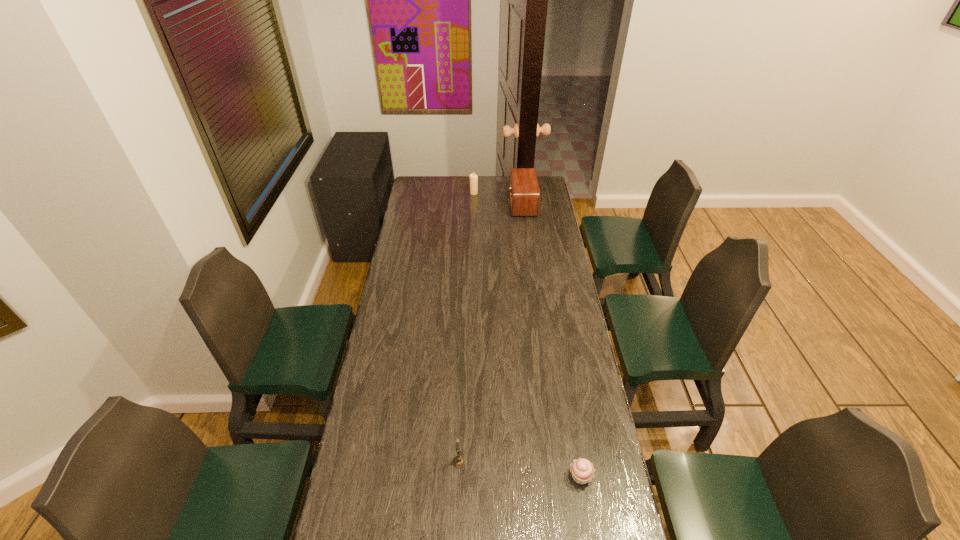
Where is `radio receiver located at the far edge`? radio receiver located at the far edge is located at coordinates (524, 193).

This screenshot has width=960, height=540. I want to click on candle that is positioned at the far edge, so click(x=473, y=177).

The height and width of the screenshot is (540, 960). Identify the location of radio receiver present at the right edge. (524, 193).

Identify the location of cupcake that is positioned at the right edge. (582, 470).

Where is `object at the far right corner`? This screenshot has height=540, width=960. object at the far right corner is located at coordinates (524, 193).

Where is `vacant space at the left edge`? vacant space at the left edge is located at coordinates [391, 299].

Locate an element on the screen. blank space at the right edge of the desktop is located at coordinates (552, 325).

Image resolution: width=960 pixels, height=540 pixels. In the image, there is a desktop. Identify the location of vacant space at the far right corner. (546, 178).

Find the location of `free area in between the nearer candle and the cupcake`. free area in between the nearer candle and the cupcake is located at coordinates (519, 469).

Identify the location of empty space that is in between the farther candle and the shortest object. (527, 335).